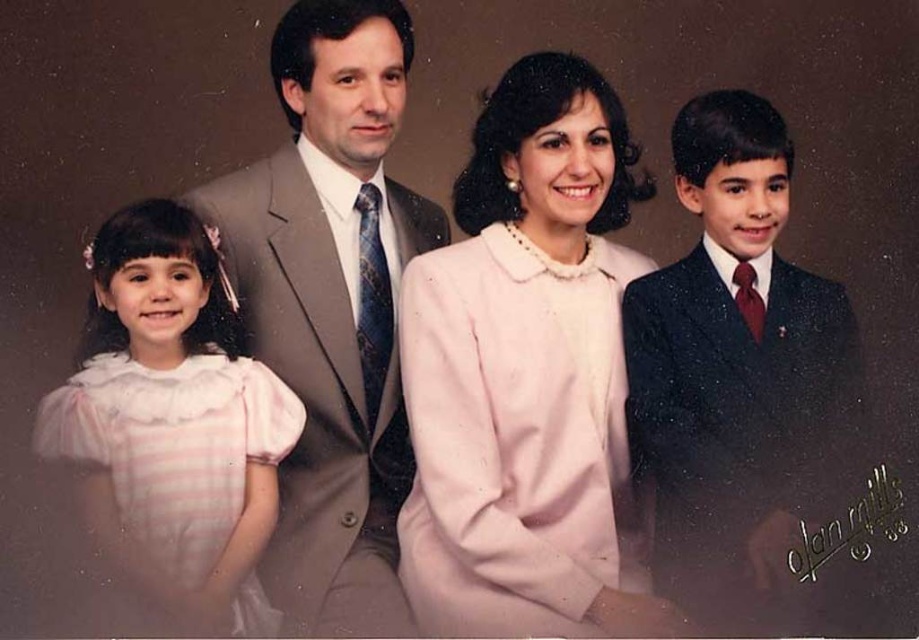
You are a photographer setting up for a family portrait. You need to position two key items in the scene. The pink satin blouse at center and the shiny dark blue suit at right must be placed exactly 10 inches apart. Based on the current setup, will you need to move either item to meet this requirement?

The current distance between the pink satin blouse at center and the shiny dark blue suit at right is 9.51 inches. Since this is less than the required 10 inches, you would need to move them slightly apart to achieve the desired spacing.

Based on the photo, in the family portrait, you notice the pink satin blouse at center and the shiny dark blue suit at right. Which clothing item appears taller in the image?

The pink satin blouse at center appears taller than the shiny dark blue suit at right in the family portrait.

In the scene shown: Where is the pink satin dress at left located in the image?

The pink satin dress at left is located at point (174,417) in the image.